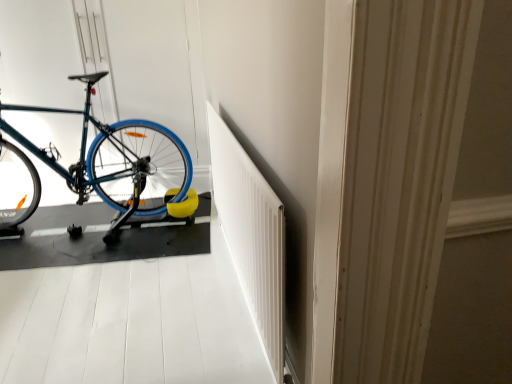
Find the location of a particular element. This screenshot has height=384, width=512. vacant region under white textured radiator at center (from a real-world perspective) is located at coordinates (242, 298).